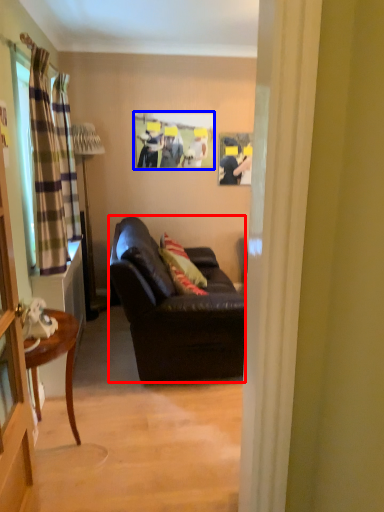
Question: Which object is further to the camera taking this photo, studio couch (highlighted by a red box) or picture frame (highlighted by a blue box)?

Choices:
 (A) studio couch
 (B) picture frame

Answer: (B)